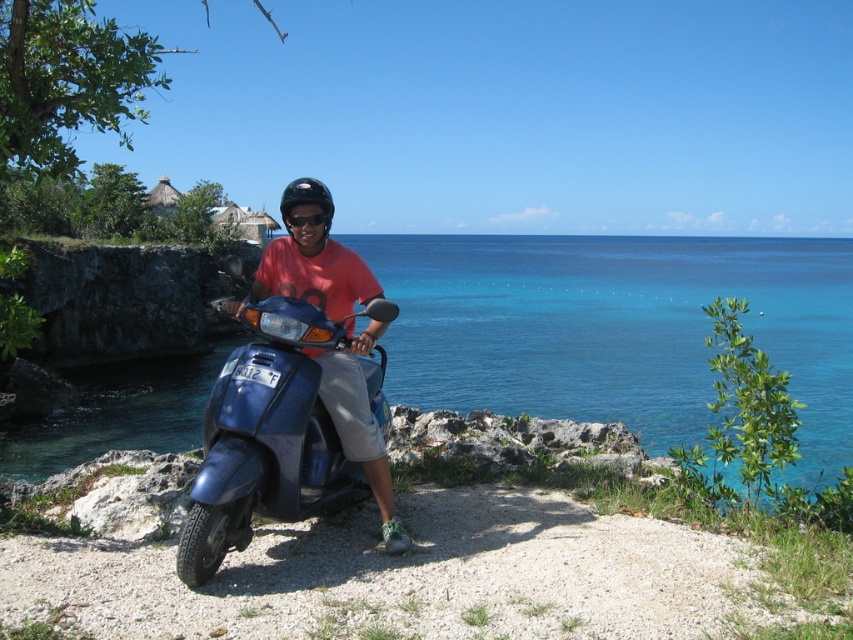
Can you confirm if blue glossy water at center is thinner than black plastic goggles at center?

No.

Is blue glossy water at center in front of black plastic goggles at center?

No, it is behind black plastic goggles at center.

Is point (454, 252) positioned behind point (303, 212)?

Yes, point (454, 252) is farther from viewer.

At what (x,y) coordinates should I click in order to perform the action: click on blue glossy water at center. Please return your answer as a coordinate pair (x, y). The width and height of the screenshot is (853, 640). Looking at the image, I should click on point(616,330).

Is matte blue scooter at center closer to camera compared to black plastic goggles at center?

Yes, it is in front of black plastic goggles at center.

Is matte blue scooter at center below black plastic goggles at center?

Yes.

The height and width of the screenshot is (640, 853). Identify the location of matte blue scooter at center. (335, 349).

Can you confirm if blue glossy water at center is bigger than matte blue scooter at center?

Yes.

Is blue glossy water at center below matte blue scooter at center?

No, blue glossy water at center is not below matte blue scooter at center.

Image resolution: width=853 pixels, height=640 pixels. In order to click on blue glossy water at center in this screenshot , I will do `click(616, 330)`.

Find the location of a particular element. The image size is (853, 640). blue glossy water at center is located at coordinates (616, 330).